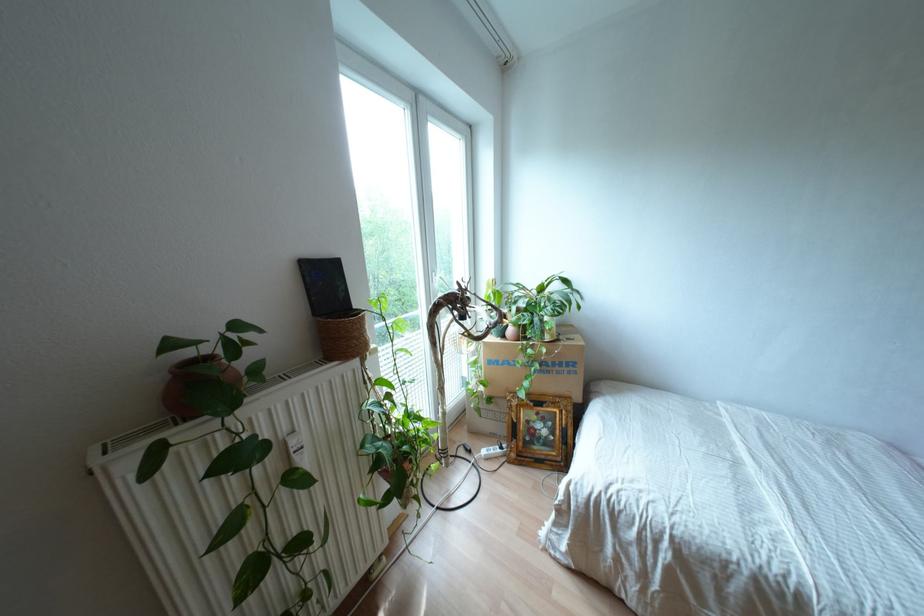
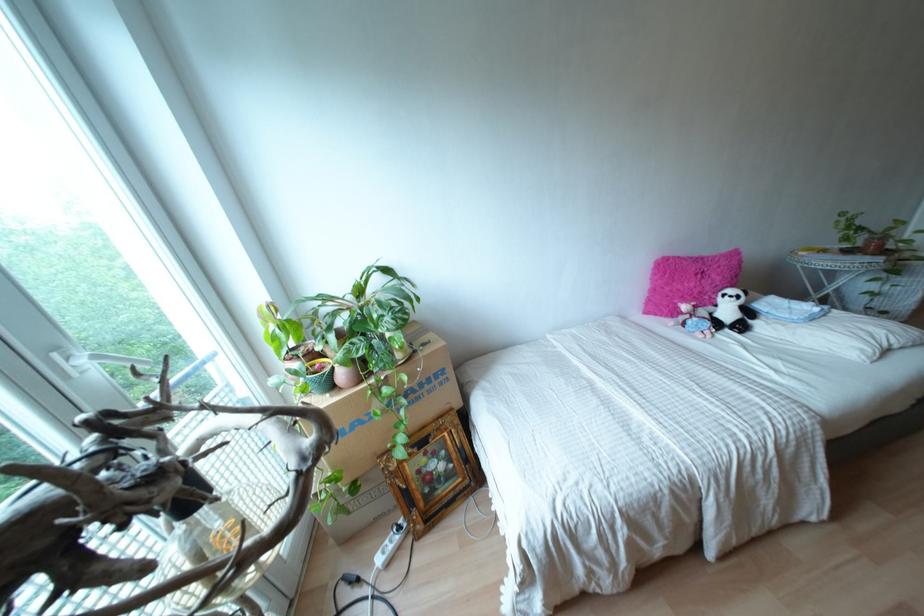
Question: Based on the continuous images, in which direction is the camera rotating? Reply with the corresponding letter.

Choices:
 (A) Left
 (B) Right
 (C) Up
 (D) Down

Answer: (B)